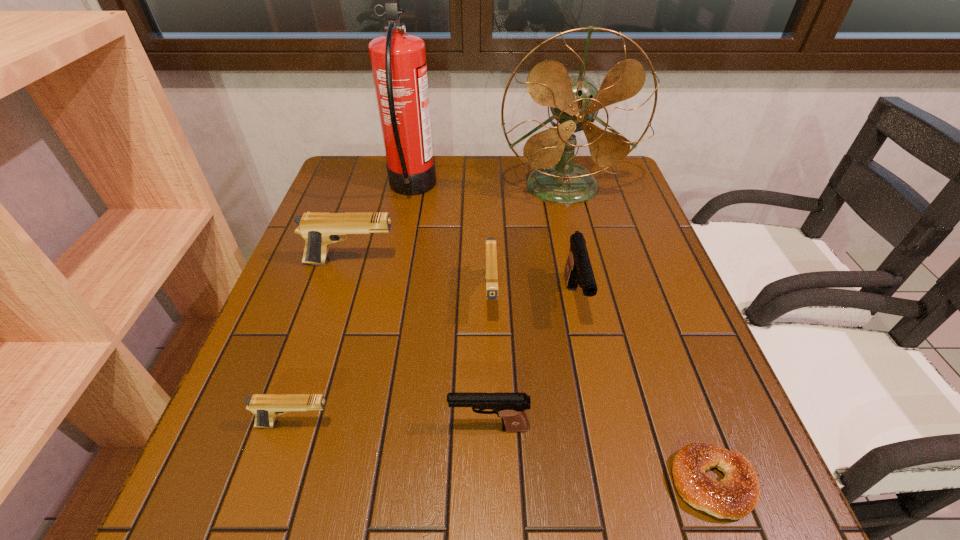
Locate an element on the screen. This screenshot has width=960, height=540. free spot between the smallest tan pistol and the farthest pistol is located at coordinates (324, 343).

Find the location of `empty location between the biggest tan pistol and the smaller black pistol`. empty location between the biggest tan pistol and the smaller black pistol is located at coordinates [x=420, y=345].

Identify the location of vacant area that lies between the fan and the right black pistol. The height and width of the screenshot is (540, 960). (568, 244).

Find the location of a particular element. The image size is (960, 540). unoccupied position between the shortest pistol and the nearer black pistol is located at coordinates (392, 426).

The width and height of the screenshot is (960, 540). Identify the location of object that stands as the second closest to the farthest pistol. (491, 274).

Where is `object that is the fifth closest to the fan`? This screenshot has width=960, height=540. object that is the fifth closest to the fan is located at coordinates click(x=510, y=407).

Select which pistol appears as the second closest to the fan. Please provide its 2D coordinates. Your answer should be formatted as a tuple, i.e. [(x, y)], where the tuple contains the x and y coordinates of a point satisfying the conditions above.

[(578, 270)]

Find the location of a particular element. This screenshot has height=540, width=960. pistol that is the fifth closest to the red fire extinguisher is located at coordinates (510, 407).

Select which tan pistol appears as the second closest to the red fire extinguisher. Please provide its 2D coordinates. Your answer should be formatted as a tuple, i.e. [(x, y)], where the tuple contains the x and y coordinates of a point satisfying the conditions above.

[(491, 274)]

Identify which tan pistol is the second closest to the nearest tan pistol. Please provide its 2D coordinates. Your answer should be formatted as a tuple, i.e. [(x, y)], where the tuple contains the x and y coordinates of a point satisfying the conditions above.

[(319, 229)]